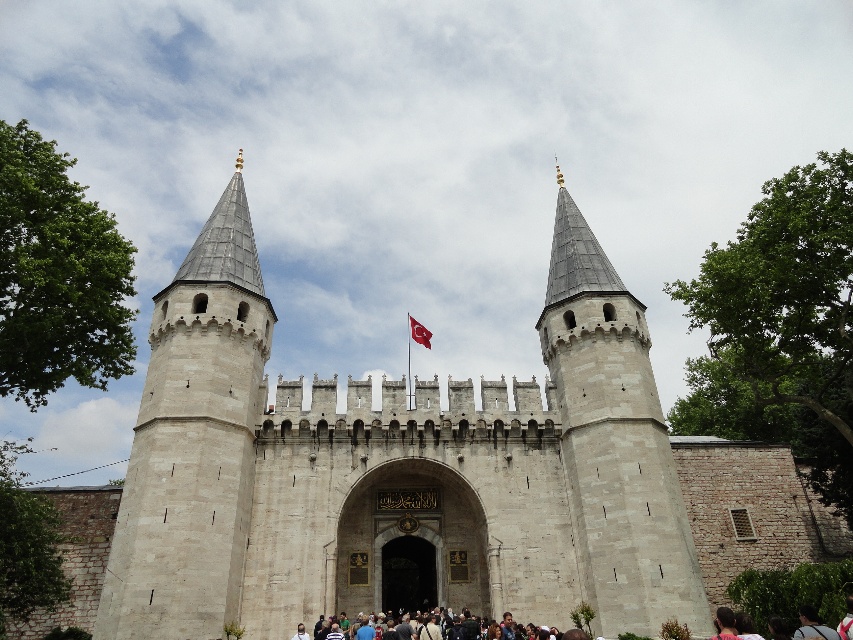
You are a tourist standing at the entrance of Topkap? Palace in Istanbul. You want to take a photo of the white stone castle at center. Where should you position yourself to capture it in the frame?

The white stone castle at center is located at coordinates point [393,467], so you should position yourself directly in front of it to capture it in the frame.

You are standing at the entrance of Topkap? Palace and want to take a photo that includes both point (602, 317) and point (572, 636). Based on their positions, which point is closer to you and should be framed first?

Point (602, 317) is closer to you and should be framed first since it is further to the viewer than point (572, 636).